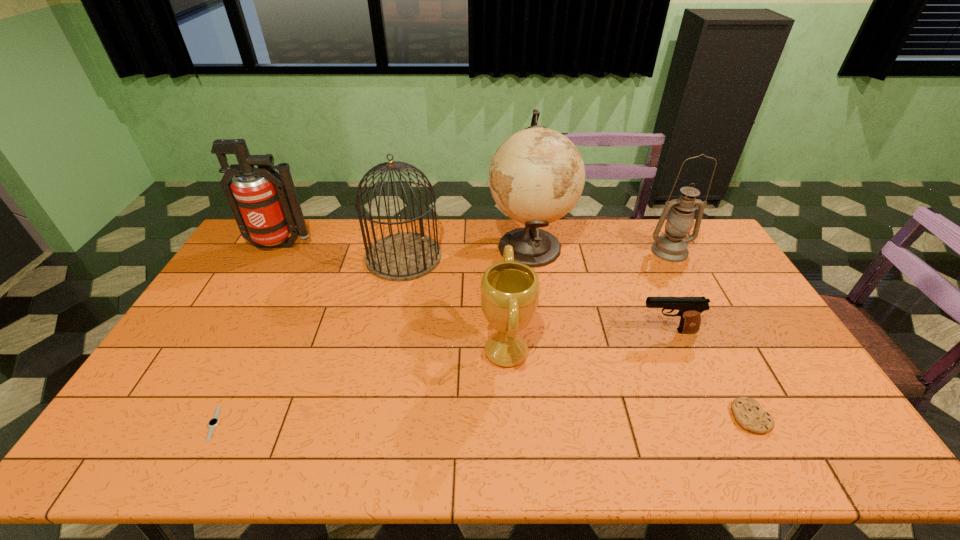
Where is `cookie that is at the right edge`? cookie that is at the right edge is located at coordinates (749, 414).

Where is `object that is at the far left corner`? The width and height of the screenshot is (960, 540). object that is at the far left corner is located at coordinates (268, 211).

Image resolution: width=960 pixels, height=540 pixels. In order to click on object that is at the far right corner in this screenshot , I will do `click(672, 246)`.

What are the coordinates of `object at the near right corner` in the screenshot? It's located at 749,414.

At what (x,y) coordinates should I click in order to perform the action: click on vacant region at the far edge of the desktop. Please return your answer as a coordinate pair (x, y). The image size is (960, 540). Looking at the image, I should click on (588, 238).

You are a GUI agent. You are given a task and a screenshot of the screen. Output one action in this format:
    pyautogui.click(x=<x>, y=<y>)
    Task: Click on the vacant space at the near edge of the desktop
    The height and width of the screenshot is (540, 960).
    Given the screenshot: What is the action you would take?
    pyautogui.click(x=523, y=463)

You are a GUI agent. You are given a task and a screenshot of the screen. Output one action in this format:
    pyautogui.click(x=<x>, y=<y>)
    Task: Click on the free space at the left edge of the desktop
    This screenshot has width=960, height=540.
    Given the screenshot: What is the action you would take?
    pyautogui.click(x=208, y=355)

This screenshot has width=960, height=540. I want to click on free space at the right edge of the desktop, so click(x=752, y=294).

The width and height of the screenshot is (960, 540). Find the location of `vacant region at the near left corner of the desktop`. vacant region at the near left corner of the desktop is located at coordinates (172, 448).

In the image, there is a desktop. What are the coordinates of `vacant space at the near right corner` in the screenshot? It's located at (847, 451).